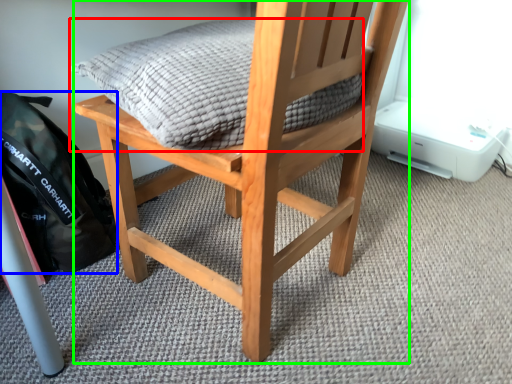
Question: Estimate the real-world distances between objects in this image. Which object is farther from pillow (highlighted by a red box), backpack (highlighted by a blue box) or chair (highlighted by a green box)?

Choices:
 (A) backpack
 (B) chair

Answer: (A)